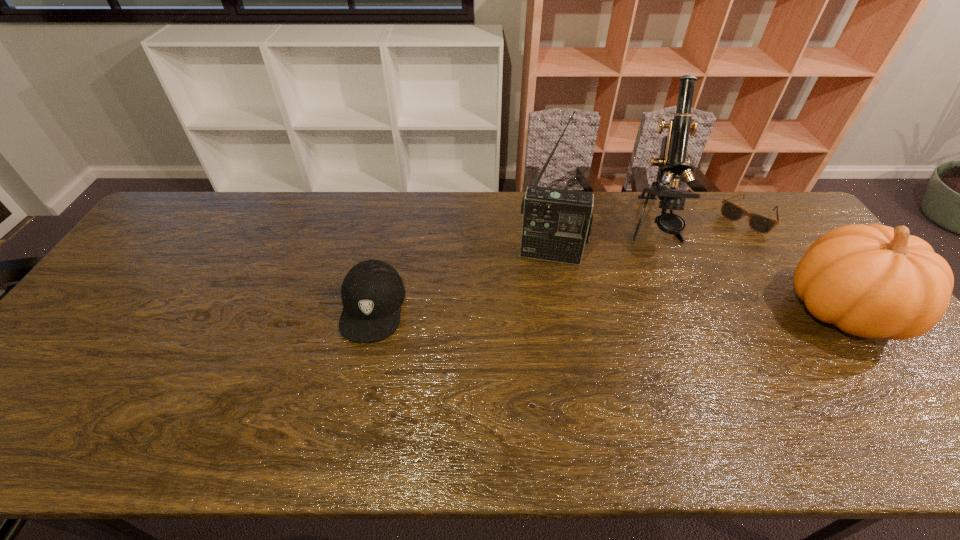
I want to click on sunglasses that is at the right edge, so click(761, 224).

Where is `object located at the far right corner`? object located at the far right corner is located at coordinates (761, 224).

At what (x,y) coordinates should I click in order to perform the action: click on free space at the far edge. Please return your answer as a coordinate pair (x, y). Image resolution: width=960 pixels, height=540 pixels. Looking at the image, I should click on (391, 222).

In the image, there is a desktop. At what (x,y) coordinates should I click in order to perform the action: click on vacant space at the near edge. Please return your answer as a coordinate pair (x, y). Looking at the image, I should click on (463, 392).

Image resolution: width=960 pixels, height=540 pixels. In order to click on vacant space at the left edge of the desktop in this screenshot , I will do `click(122, 295)`.

The height and width of the screenshot is (540, 960). Identify the location of vacant point located between the sunglasses and the pumpkin. (795, 264).

The width and height of the screenshot is (960, 540). In order to click on free space that is in between the third object from right to left and the sunglasses in this screenshot , I will do `click(700, 222)`.

Locate an element on the screen. The width and height of the screenshot is (960, 540). free space between the microscope and the shortest object is located at coordinates pyautogui.click(x=700, y=222).

The width and height of the screenshot is (960, 540). Identify the location of vacant area that lies between the third shortest object and the third object from left to right. (747, 268).

Locate an element on the screen. Image resolution: width=960 pixels, height=540 pixels. blank region between the fourth object from right to left and the third object from right to left is located at coordinates (601, 241).